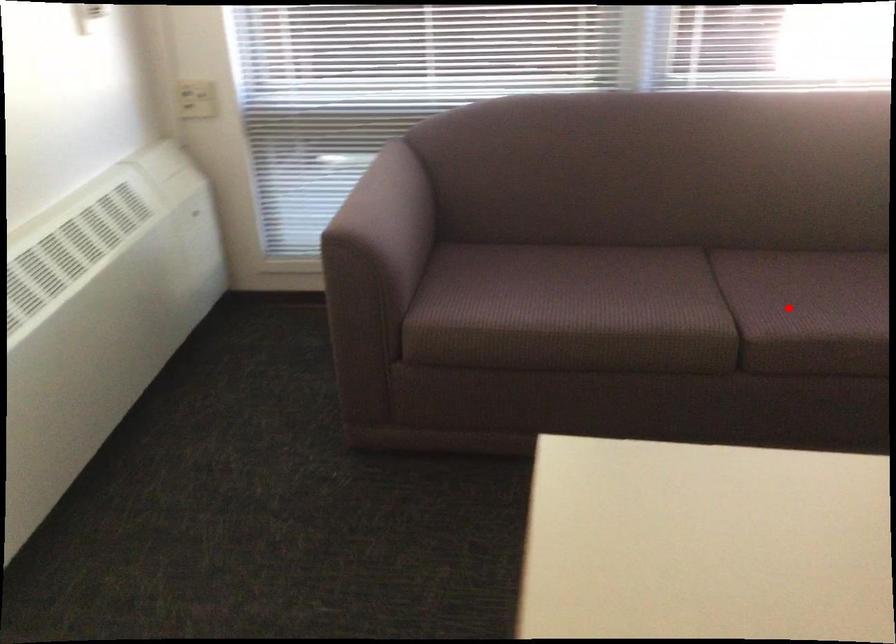
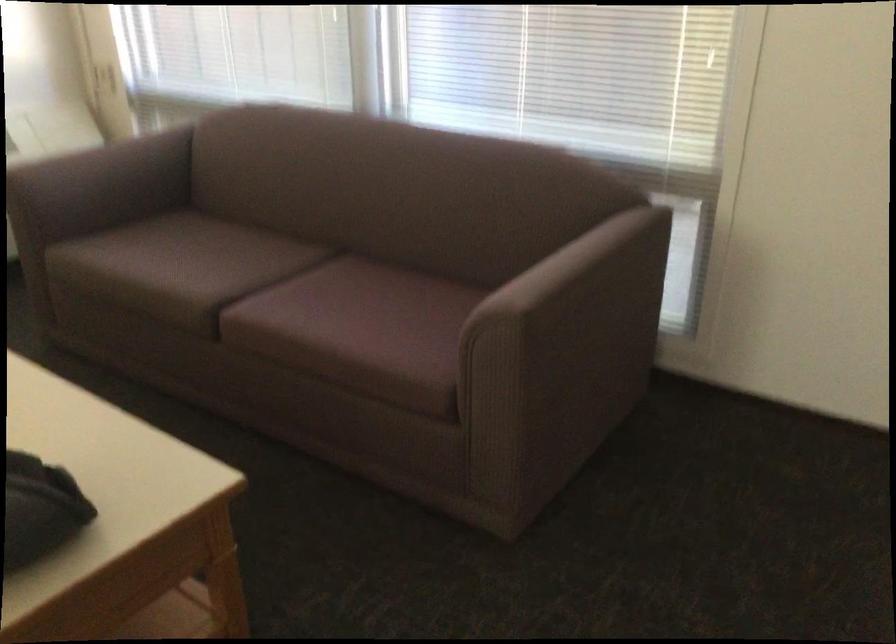
Question: I am providing you with two images of the same scene from different viewpoints. A red point is shown in image1. For the corresponding object point in image2, is it positioned nearer or farther from the camera?

Choices:
 (A) Nearer
 (B) Farther

Answer: (B)